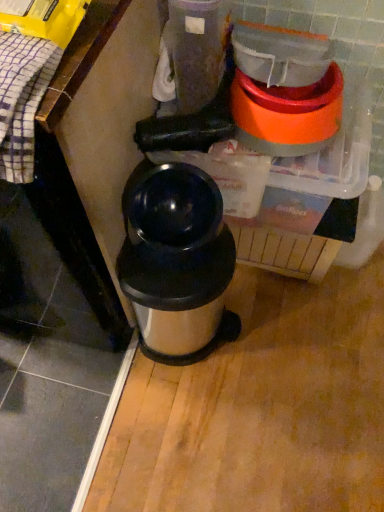
Question: Is orange plastic blender at upper right wider than stainless steel thermos at center?

Choices:
 (A) no
 (B) yes

Answer: (B)

Question: Is orange plastic blender at upper right facing away from stainless steel thermos at center?

Choices:
 (A) no
 (B) yes

Answer: (A)

Question: Does orange plastic blender at upper right have a larger size compared to stainless steel thermos at center?

Choices:
 (A) no
 (B) yes

Answer: (A)

Question: Can you see orange plastic blender at upper right touching stainless steel thermos at center?

Choices:
 (A) no
 (B) yes

Answer: (A)

Question: Is the depth of orange plastic blender at upper right less than that of stainless steel thermos at center?

Choices:
 (A) yes
 (B) no

Answer: (A)

Question: Considering the relative sizes of orange plastic blender at upper right and stainless steel thermos at center in the image provided, is orange plastic blender at upper right shorter than stainless steel thermos at center?

Choices:
 (A) no
 (B) yes

Answer: (B)

Question: Is stainless steel thermos at center not close to orange plastic blender at upper right?

Choices:
 (A) yes
 (B) no

Answer: (B)

Question: Does stainless steel thermos at center have a larger size compared to orange plastic blender at upper right?

Choices:
 (A) yes
 (B) no

Answer: (A)

Question: From a real-world perspective, is stainless steel thermos at center on top of orange plastic blender at upper right?

Choices:
 (A) no
 (B) yes

Answer: (A)

Question: Does stainless steel thermos at center touch orange plastic blender at upper right?

Choices:
 (A) yes
 (B) no

Answer: (B)

Question: From the image's perspective, would you say stainless steel thermos at center is shown under orange plastic blender at upper right?

Choices:
 (A) no
 (B) yes

Answer: (B)

Question: Does stainless steel thermos at center have a smaller size compared to orange plastic blender at upper right?

Choices:
 (A) yes
 (B) no

Answer: (B)

Question: Do you think stainless steel thermos at center is within orange plastic blender at upper right, or outside of it?

Choices:
 (A) inside
 (B) outside

Answer: (B)